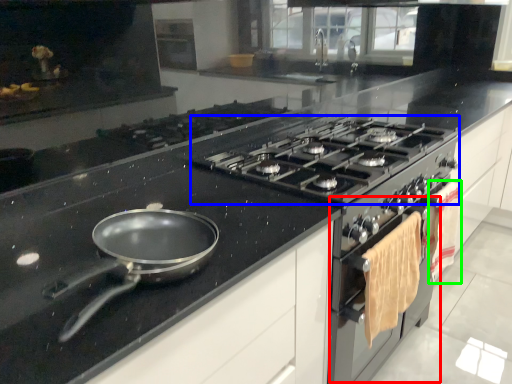
Question: Estimate the real-world distances between objects in this image. Which object is farther from oven (highlighted by a red box), gas stove (highlighted by a blue box) or material (highlighted by a green box)?

Choices:
 (A) gas stove
 (B) material

Answer: (A)